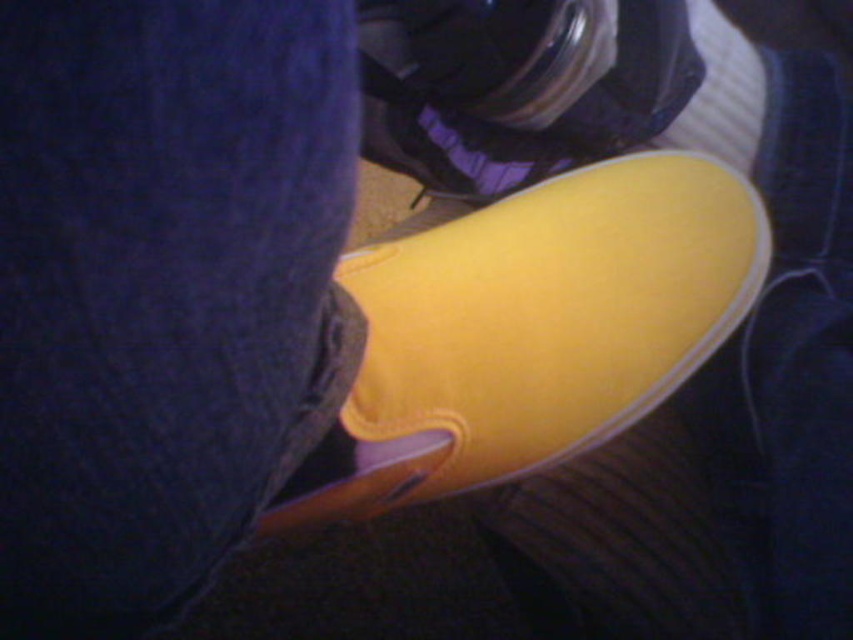
Is yellow canvas shoe at center below yellow fabric shoe at center?

Yes.

Between yellow canvas shoe at center and yellow fabric shoe at center, which one has more height?

yellow canvas shoe at center is taller.

You are a GUI agent. You are given a task and a screenshot of the screen. Output one action in this format:
    pyautogui.click(x=<x>, y=<y>)
    Task: Click on the yellow canvas shoe at center
    
    Given the screenshot: What is the action you would take?
    pyautogui.click(x=532, y=330)

Where is `yellow canvas shoe at center`? This screenshot has width=853, height=640. yellow canvas shoe at center is located at coordinates (532, 330).